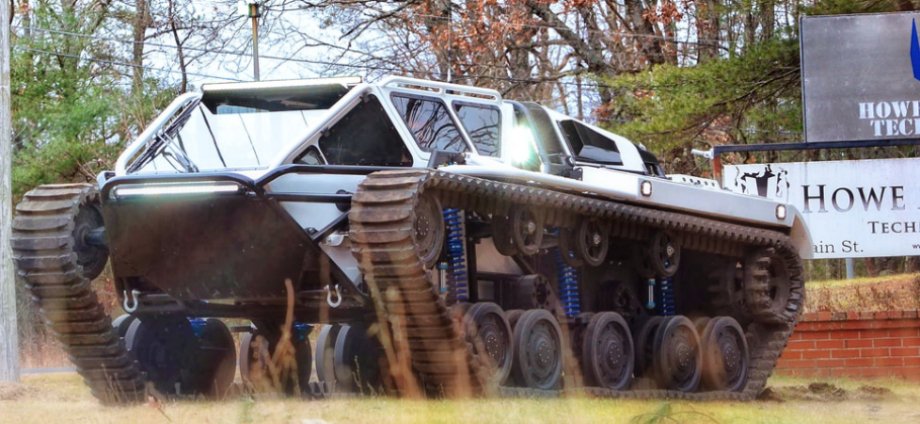
Where is `brick wall`? Image resolution: width=920 pixels, height=424 pixels. brick wall is located at coordinates (875, 343).